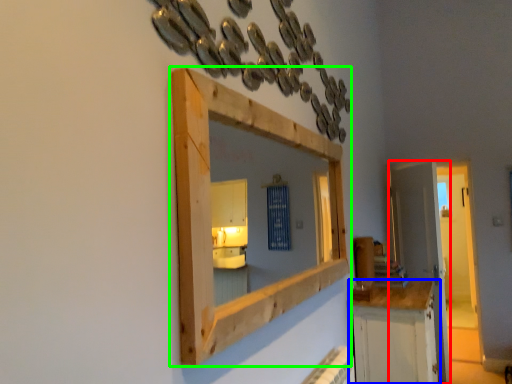
Question: Based on their relative distances, which object is farther from door (highlighted by a red box)? Choose from cabinetry (highlighted by a blue box) and medicine cabinet (highlighted by a green box).

Choices:
 (A) cabinetry
 (B) medicine cabinet

Answer: (B)